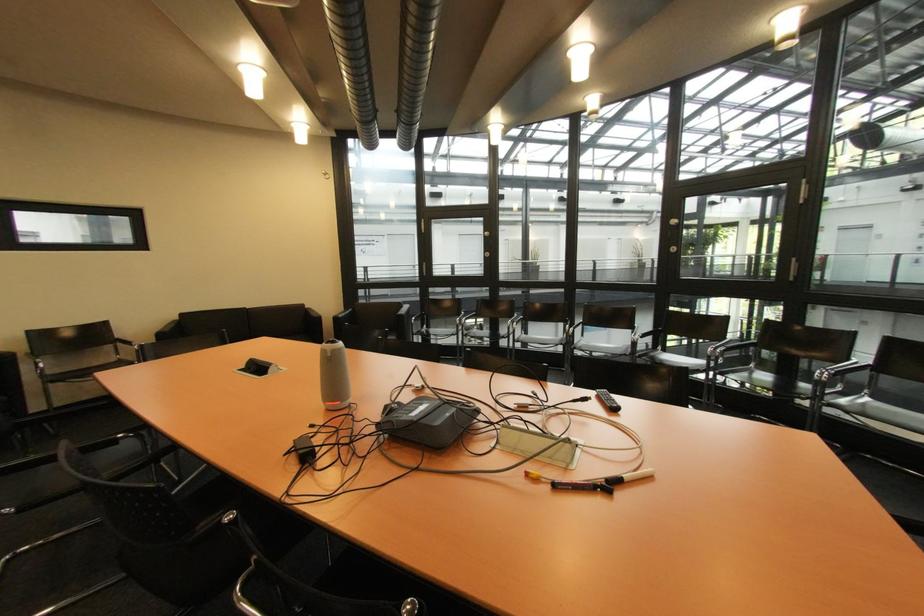
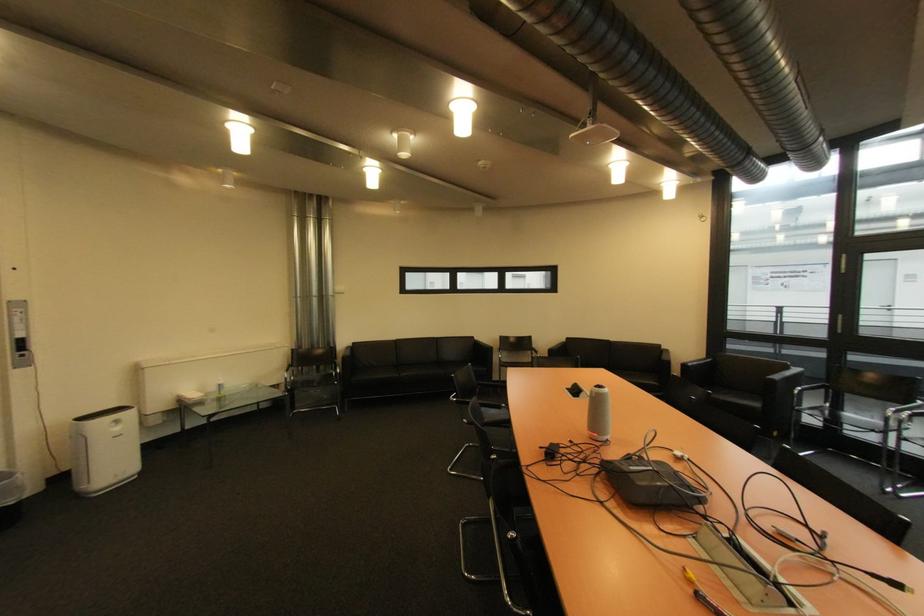
Where in the second image is the point corresponding to the point at 251,368 from the first image?

(578, 389)